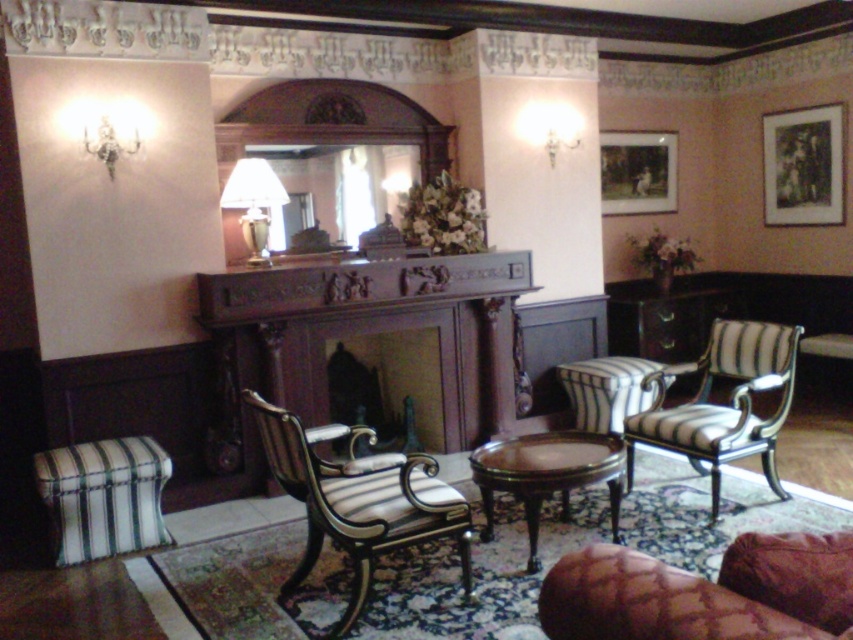
Question: Can you confirm if leather couch at lower right is wider than black matte picture frame at upper right?

Choices:
 (A) yes
 (B) no

Answer: (A)

Question: In this image, where is white striped fabric armchair at center located relative to matte white glass lamp at left?

Choices:
 (A) below
 (B) above

Answer: (A)

Question: Is wooden fireplace at center above matte white glass lamp at left?

Choices:
 (A) no
 (B) yes

Answer: (A)

Question: Which of these objects is positioned closest to the green striped fabric stool at lower left?

Choices:
 (A) leather couch at lower right
 (B) black matte picture frame at upper right
 (C) striped fabric armchair at right

Answer: (C)

Question: Which is nearer to the black matte picture frame at upper right?

Choices:
 (A) mahogany wood coffee table at center
 (B) matte white glass lamp at left
 (C) leather couch at lower right

Answer: (A)

Question: Considering the real-world distances, which object is farthest from the leather couch at lower right?

Choices:
 (A) mahogany wood coffee table at center
 (B) green striped fabric stool at lower left
 (C) matte white glass lamp at left

Answer: (C)